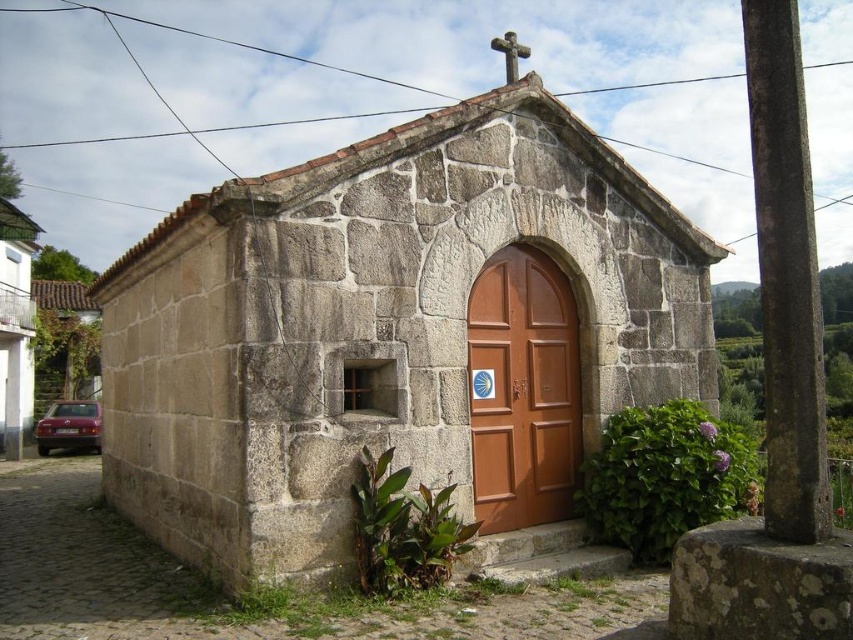
You are standing in front of the brown wooden door at center and want to enter the white stone church at left. Is the door large enough for a standard 6 feet tall person to walk through comfortably?

The brown wooden door at center is smaller than the white stone church at left, but the description does not provide specific height measurements. However, standard doors are typically designed to accommodate average human height, so it is likely the door is tall enough for a 6 feet tall person to enter comfortably.

You are standing at the entrance of the stone chapel and want to take a photo of the point marked as point (x=393, y=333). Is this point located at the center of the chapel?

The stone church at center is represented by point (x=393, y=333), so yes, the point is at the center of the chapel.